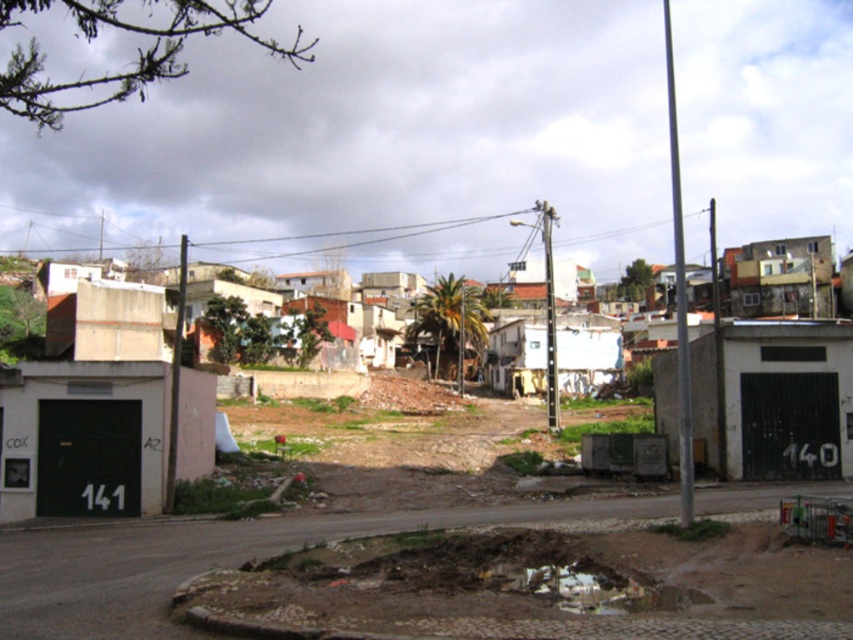
From the picture: Does brown soil at center appear on the right side of concrete building at center?

Incorrect, brown soil at center is not on the right side of concrete building at center.

Can you confirm if brown soil at center is wider than concrete building at center?

In fact, brown soil at center might be narrower than concrete building at center.

Is point (306, 403) farther from camera compared to point (105, 310)?

Yes, it is behind point (105, 310).

Find the location of a particular element. This screenshot has height=640, width=853. brown soil at center is located at coordinates (421, 428).